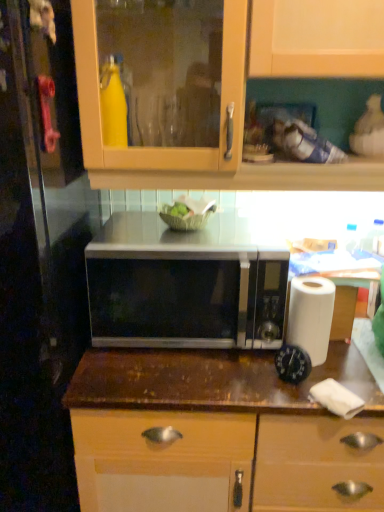
Identify the location of vacant space behind white paper towel at lower right. (326, 362).